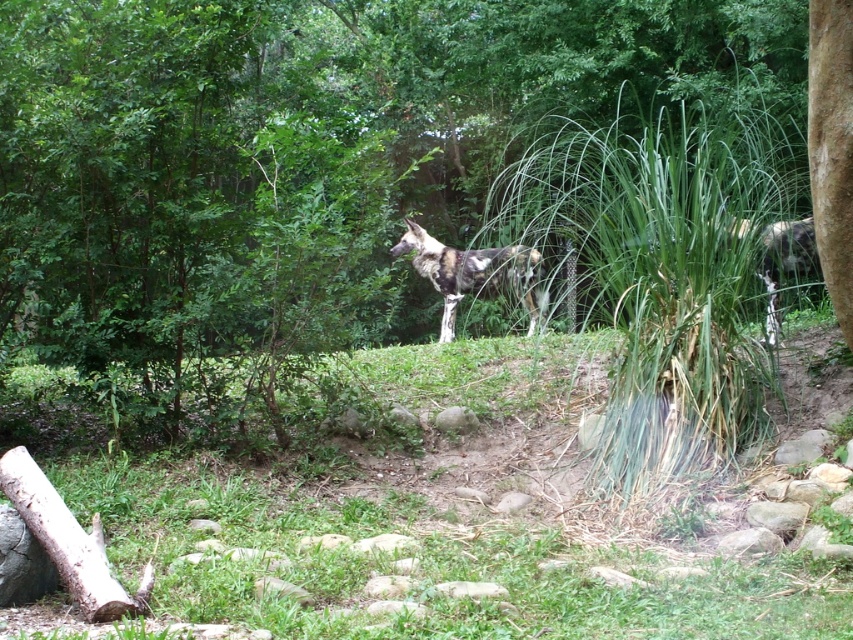
Does green grass at center have a larger size compared to spotted fur wild dog at center?

No.

Which is behind, point (492, 474) or point (459, 278)?

Positioned behind is point (459, 278).

Where is `green grass at center`? green grass at center is located at coordinates (450, 516).